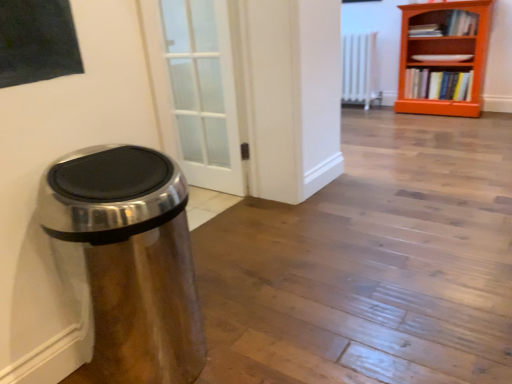
Locate an element on the screen. The image size is (512, 384). free spot above hardcover book at upper right, the 2th book ordered from the bottom (from a real-world perspective) is located at coordinates (464, 11).